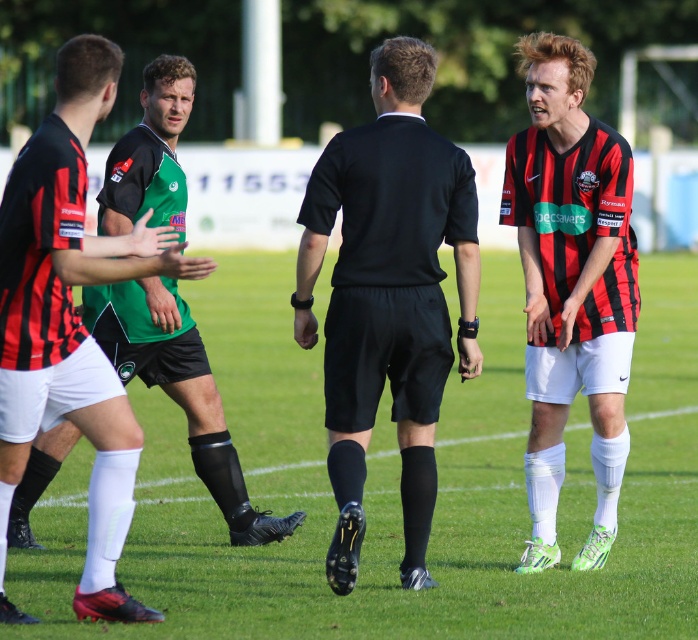
Question: Is the position of matte black shorts at right more distant than that of black matte shorts at center?

Choices:
 (A) no
 (B) yes

Answer: (A)

Question: Is the position of matte black shorts at right less distant than that of black matte shorts at center?

Choices:
 (A) yes
 (B) no

Answer: (A)

Question: Among these points, which one is nearest to the camera?

Choices:
 (A) (403, 300)
 (B) (165, 102)
 (C) (565, 216)

Answer: (A)

Question: Is black matte referee at center positioned behind black matte shorts at center?

Choices:
 (A) no
 (B) yes

Answer: (A)

Question: Estimate the real-world distances between objects in this image. Which object is farther from the black matte referee at center?

Choices:
 (A) matte black shorts at right
 (B) black matte shorts at center

Answer: (B)

Question: Which of the following is the closest to the observer?

Choices:
 (A) (609, 388)
 (B) (43, 474)
 (C) (396, 216)

Answer: (C)